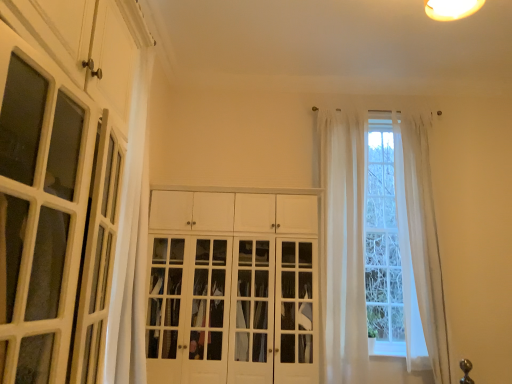
Question: From the image's perspective, is white glossy cabinet doors at center positioned above or below sheer white curtain at center, arranged as the first curtain when viewed from the left?

Choices:
 (A) below
 (B) above

Answer: (A)

Question: Is point (301, 367) positioned closer to the camera than point (347, 168)?

Choices:
 (A) closer
 (B) farther

Answer: (A)

Question: Which object is the closest to the white glossy cabinet doors at center?

Choices:
 (A) sheer white curtain at center, which appears as the second curtain when viewed from the right
 (B) white sheer curtain at right, which appears as the 1th curtain when viewed from the right
 (C) white glossy cabinet at left

Answer: (A)

Question: Estimate the real-world distances between objects in this image. Which object is closer to the white glossy cabinet doors at center?

Choices:
 (A) white sheer curtain at right, the second curtain in the left-to-right sequence
 (B) white glossy cabinet at left
 (C) sheer white curtain at center, which appears as the second curtain when viewed from the right

Answer: (C)